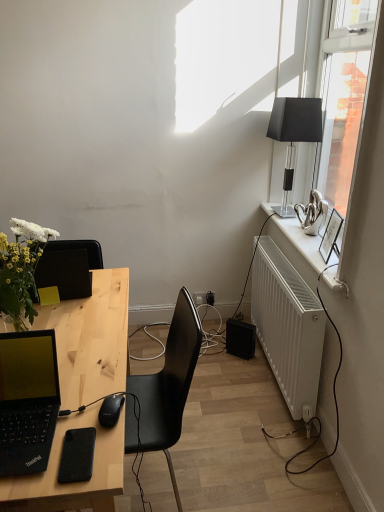
Question: Is black matte phone at lower left thinner than transparent glass window at upper right?

Choices:
 (A) no
 (B) yes

Answer: (A)

Question: Is black matte phone at lower left at the left side of transparent glass window at upper right?

Choices:
 (A) no
 (B) yes

Answer: (B)

Question: Is black matte phone at lower left wider than transparent glass window at upper right?

Choices:
 (A) no
 (B) yes

Answer: (B)

Question: Is black matte phone at lower left oriented towards transparent glass window at upper right?

Choices:
 (A) yes
 (B) no

Answer: (B)

Question: Does black matte phone at lower left lie behind transparent glass window at upper right?

Choices:
 (A) yes
 (B) no

Answer: (B)

Question: Is point (266, 337) closer or farther from the camera than point (66, 476)?

Choices:
 (A) farther
 (B) closer

Answer: (A)

Question: Is white matte radiator at right inside the boundaries of black matte phone at lower left, or outside?

Choices:
 (A) outside
 (B) inside

Answer: (A)

Question: Considering their positions, is white matte radiator at right located in front of or behind black matte phone at lower left?

Choices:
 (A) front
 (B) behind

Answer: (B)

Question: Looking at their shapes, would you say white matte radiator at right is wider or thinner than black matte phone at lower left?

Choices:
 (A) wide
 (B) thin

Answer: (B)

Question: Choose the correct answer: Is transparent glass window at upper right inside black matte mouse at lower left or outside it?

Choices:
 (A) inside
 (B) outside

Answer: (B)

Question: Is point (332, 260) closer or farther from the camera than point (110, 395)?

Choices:
 (A) farther
 (B) closer

Answer: (A)

Question: Would you say transparent glass window at upper right is to the left or to the right of black matte mouse at lower left in the picture?

Choices:
 (A) left
 (B) right

Answer: (B)

Question: From a real-world perspective, is transparent glass window at upper right physically located above or below black matte mouse at lower left?

Choices:
 (A) above
 (B) below

Answer: (A)

Question: From a real-world perspective, is white glossy radiator at right above or below black matte laptop at left?

Choices:
 (A) above
 (B) below

Answer: (B)

Question: In the image, is white glossy radiator at right on the left side or the right side of black matte laptop at left?

Choices:
 (A) right
 (B) left

Answer: (A)